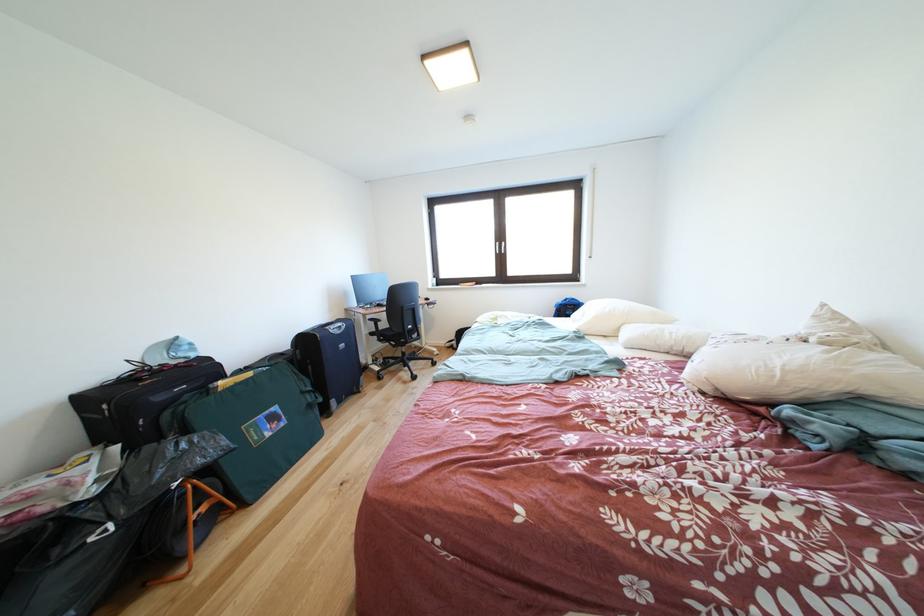
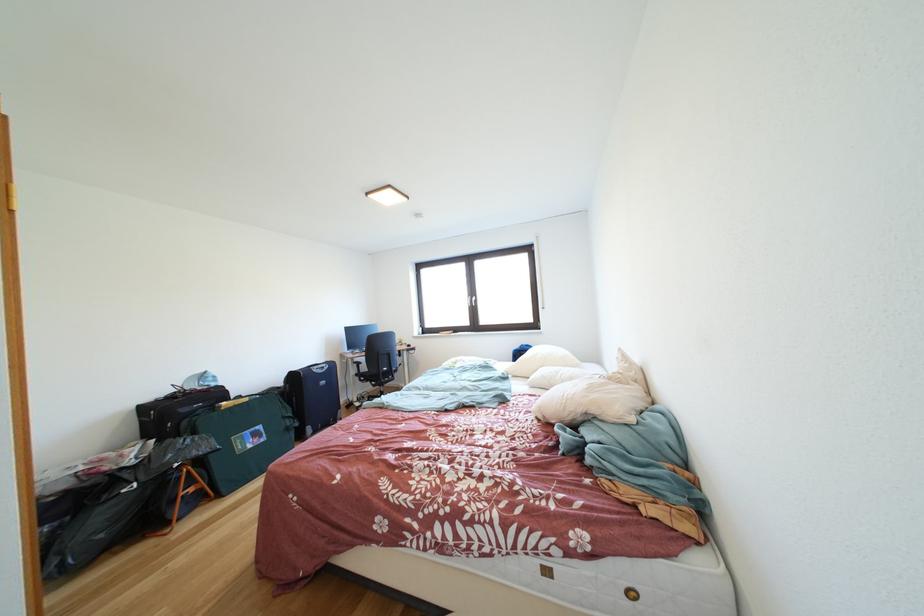
Locate, in the second image, the point that corresponds to [661,329] in the first image.

(570, 371)